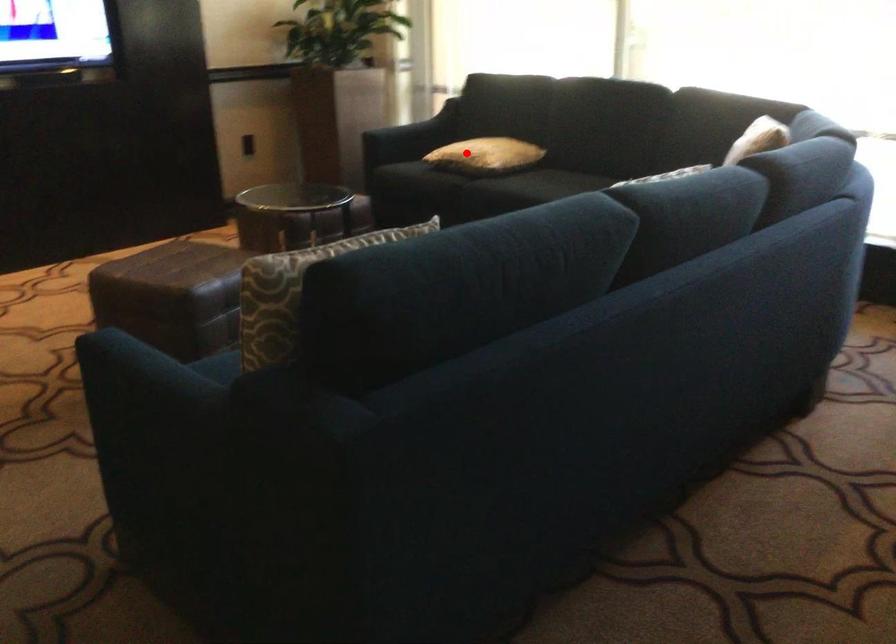
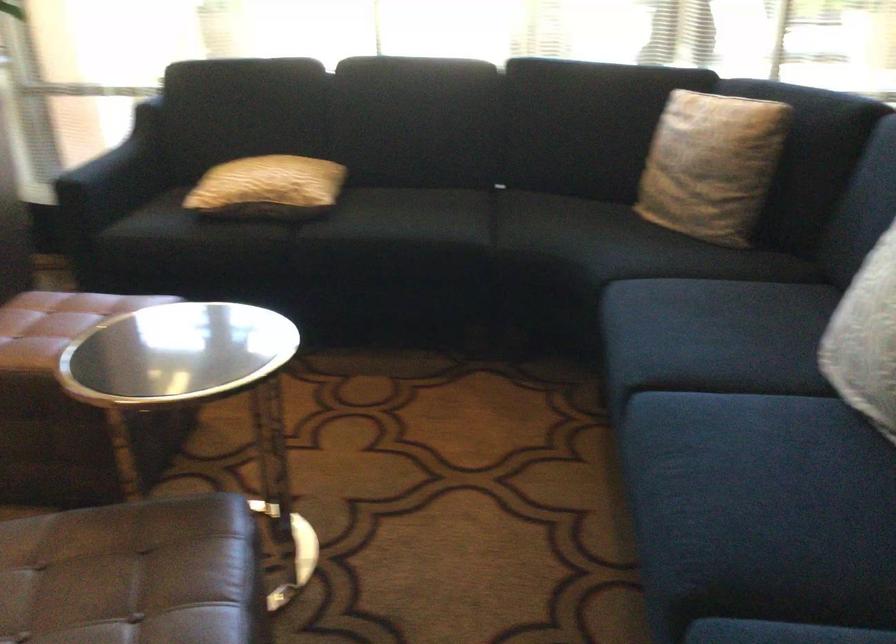
Question: I am providing you with two images of the same scene from different viewpoints. Given a red point in image1, look at the same physical point in image2. Is it:

Choices:
 (A) Closer to the viewpoint
 (B) Farther from the viewpoint

Answer: (A)